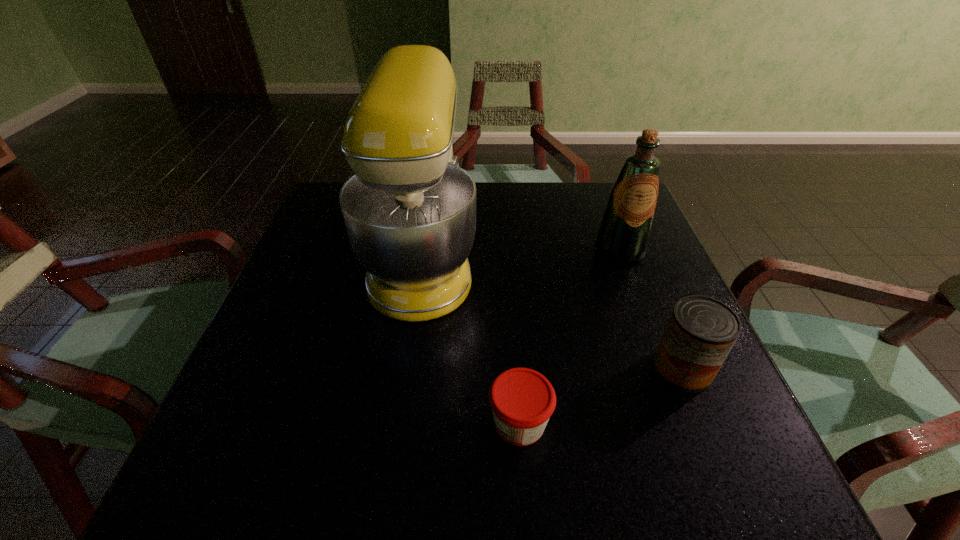
At what (x,y) coordinates should I click in order to perform the action: click on free spot at the right edge of the desktop. Please return your answer as a coordinate pair (x, y). Image resolution: width=960 pixels, height=540 pixels. Looking at the image, I should click on (658, 246).

Identify the location of vacant space at the near left corner of the desktop. (204, 471).

Find the location of a particular element. This screenshot has width=960, height=540. blank area at the near right corner is located at coordinates (667, 489).

This screenshot has height=540, width=960. What are the coordinates of `vacant area that lies between the leftmost object and the jam` in the screenshot? It's located at (471, 341).

Find the location of a particular element. vacant point located between the third shortest object and the nearest object is located at coordinates (569, 336).

Locate an element on the screen. This screenshot has width=960, height=540. free space between the leftmost object and the olive oil is located at coordinates (521, 254).

You are a GUI agent. You are given a task and a screenshot of the screen. Output one action in this format:
    pyautogui.click(x=<x>, y=<y>)
    Task: Click on the unoccupied position between the third shortest object and the second object from left to right
    
    Given the screenshot: What is the action you would take?
    pyautogui.click(x=569, y=336)

Locate an element on the screen. Image resolution: width=960 pixels, height=540 pixels. unoccupied position between the olive oil and the leftmost object is located at coordinates [521, 254].

Where is `free space between the olive oil and the leftmost object`? This screenshot has height=540, width=960. free space between the olive oil and the leftmost object is located at coordinates (521, 254).

The width and height of the screenshot is (960, 540). In order to click on blank region between the second tallest object and the leftmost object in this screenshot , I will do `click(521, 254)`.